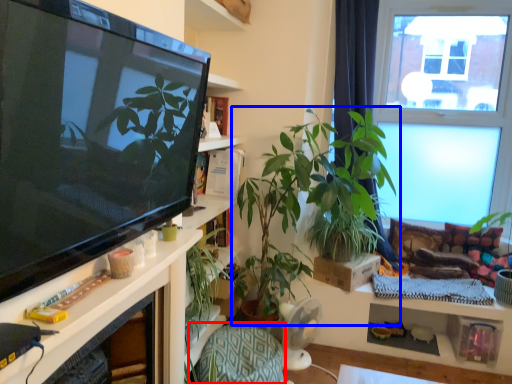
Question: Which object appears farthest to the camera in this image, armchair (highlighted by a red box) or houseplant (highlighted by a blue box)?

Choices:
 (A) armchair
 (B) houseplant

Answer: (A)